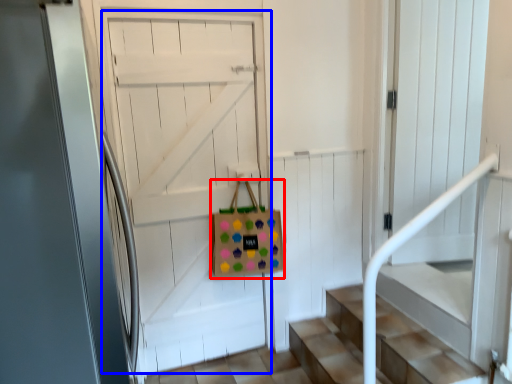
Question: Which of the following is the closest to the observer, shopping bag (highlighted by a red box) or door (highlighted by a blue box)?

Choices:
 (A) shopping bag
 (B) door

Answer: (B)